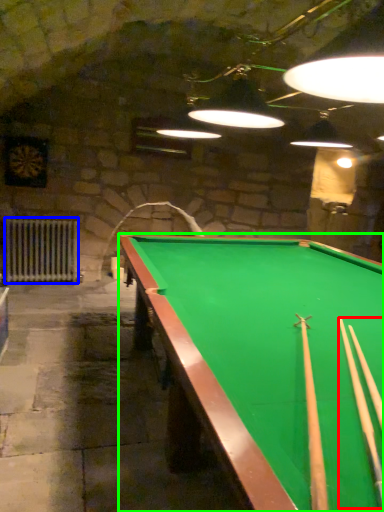
Question: Which object is positioned farthest from cue (highlighted by a red box)? Select from radiator (highlighted by a blue box) and billiard table (highlighted by a green box).

Choices:
 (A) radiator
 (B) billiard table

Answer: (A)